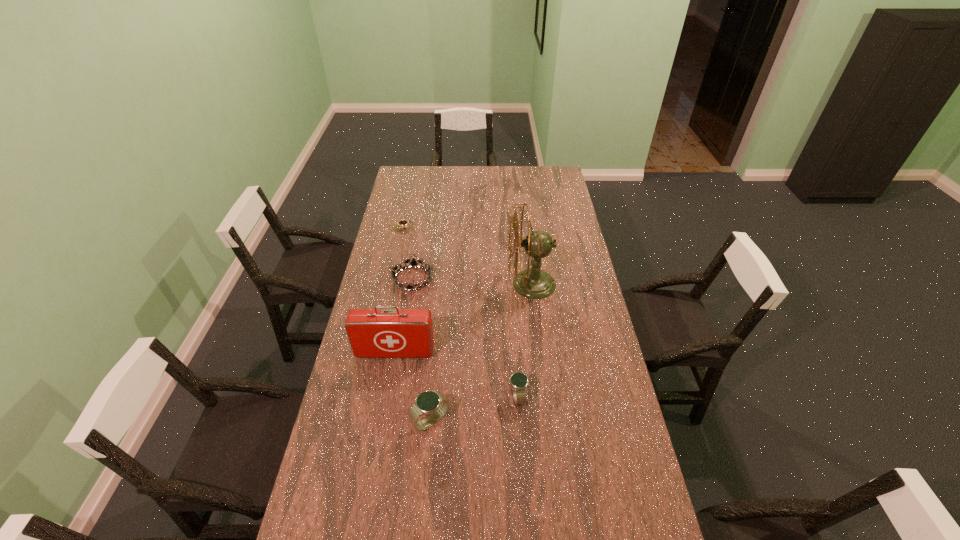
Locate an element on the screen. The image size is (960, 540). tiara that is at the left edge is located at coordinates (413, 263).

Image resolution: width=960 pixels, height=540 pixels. Identify the location of object at the right edge. (534, 283).

Locate an element on the screen. The width and height of the screenshot is (960, 540). vacant area at the far edge of the desktop is located at coordinates (446, 187).

Locate an element on the screen. The width and height of the screenshot is (960, 540). vacant space at the near edge of the desktop is located at coordinates (441, 532).

The width and height of the screenshot is (960, 540). In the image, there is a desktop. In order to click on vacant space at the left edge in this screenshot , I will do `click(371, 487)`.

Where is `vacant space at the right edge of the desktop`? The width and height of the screenshot is (960, 540). vacant space at the right edge of the desktop is located at coordinates (550, 195).

You are a GUI agent. You are given a task and a screenshot of the screen. Output one action in this format:
    pyautogui.click(x=<x>, y=<y>)
    Task: Click on the vacant region at the far right corner of the desktop
    
    Given the screenshot: What is the action you would take?
    pyautogui.click(x=547, y=187)

Find the location of a particular element. Image resolution: width=960 pixels, height=540 pixels. empty space that is in between the rightmost watch and the tallest object is located at coordinates (525, 340).

In order to click on free area in between the farthest object and the third shortest object in this screenshot , I will do `click(461, 312)`.

At what (x,y) coordinates should I click in order to perform the action: click on vacant space in between the second watch from right to left and the fourth tallest object. Please return your answer as a coordinate pair (x, y). Looking at the image, I should click on (474, 409).